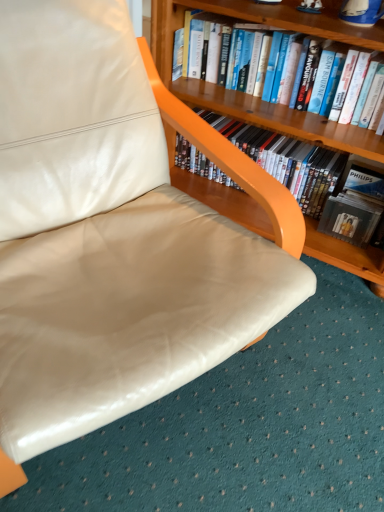
Question: Is hardcover book at upper center, the second book in the bottom-to-top sequence, inside the boundaries of wooden bookcase at upper right, or outside?

Choices:
 (A) outside
 (B) inside

Answer: (B)

Question: Is hardcover book at upper center, the second book in the bottom-to-top sequence, in front of or behind wooden bookcase at upper right in the image?

Choices:
 (A) behind
 (B) front

Answer: (A)

Question: Considering the real-world distances, which object is closest to the hardcover book at upper center, the first book when ordered from top to bottom?

Choices:
 (A) wooden bookcase at upper right
 (B) matte black dvd case at upper right, which is the first book from bottom to top

Answer: (A)

Question: Which is nearer to the matte black dvd case at upper right, marked as the second book in a top-to-bottom arrangement?

Choices:
 (A) wooden bookcase at upper right
 (B) hardcover book at upper center, the second book in the bottom-to-top sequence

Answer: (A)